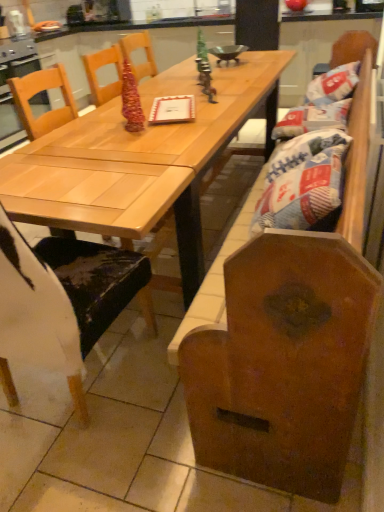
Question: Considering the relative sizes of light wood table at center and wooden chair at left in the image provided, is light wood table at center bigger than wooden chair at left?

Choices:
 (A) no
 (B) yes

Answer: (B)

Question: Would you say light wood table at center is a long distance from wooden chair at left?

Choices:
 (A) no
 (B) yes

Answer: (A)

Question: Is light wood table at center aimed at wooden chair at left?

Choices:
 (A) yes
 (B) no

Answer: (B)

Question: Considering the relative sizes of light wood table at center and wooden chair at left in the image provided, is light wood table at center thinner than wooden chair at left?

Choices:
 (A) yes
 (B) no

Answer: (B)

Question: From a real-world perspective, is light wood table at center on wooden chair at left?

Choices:
 (A) no
 (B) yes

Answer: (A)

Question: Is light wood table at center to the right of wooden chair at left from the viewer's perspective?

Choices:
 (A) yes
 (B) no

Answer: (A)

Question: Considering the relative sizes of wooden chair at left and white paper bag at right in the image provided, is wooden chair at left bigger than white paper bag at right?

Choices:
 (A) yes
 (B) no

Answer: (A)

Question: Would you say white paper bag at right is part of wooden chair at left's contents?

Choices:
 (A) no
 (B) yes

Answer: (A)

Question: Is wooden chair at left positioned behind white paper bag at right?

Choices:
 (A) yes
 (B) no

Answer: (B)

Question: From the image's perspective, would you say wooden chair at left is shown under white paper bag at right?

Choices:
 (A) no
 (B) yes

Answer: (B)

Question: Considering the relative sizes of wooden chair at left and white paper bag at right in the image provided, is wooden chair at left taller than white paper bag at right?

Choices:
 (A) yes
 (B) no

Answer: (A)

Question: Is wooden chair at left in front of white paper bag at right?

Choices:
 (A) no
 (B) yes

Answer: (B)

Question: Considering the relative sizes of white paper bag at right and light wood table at center in the image provided, is white paper bag at right shorter than light wood table at center?

Choices:
 (A) yes
 (B) no

Answer: (A)